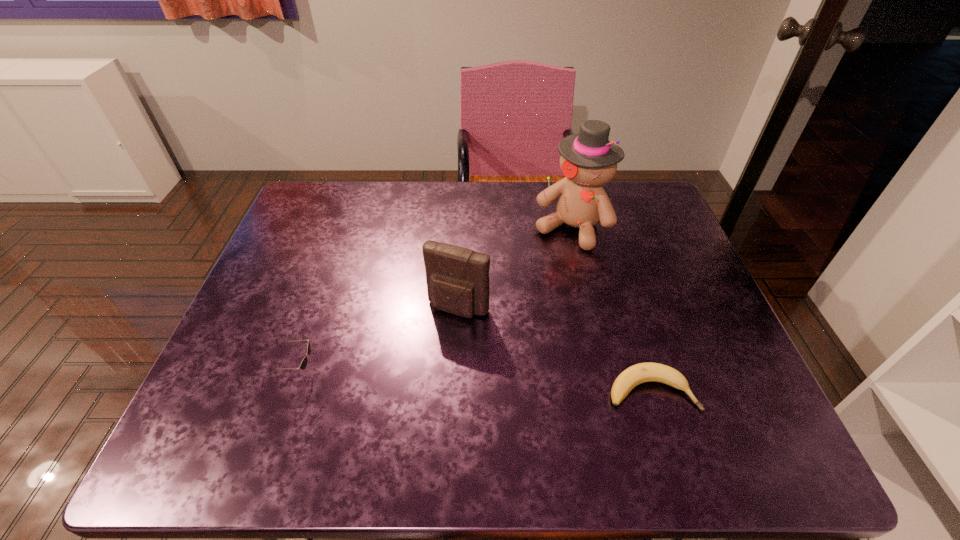
This screenshot has height=540, width=960. In order to click on free space that is in between the banana and the tallest object in this screenshot , I will do click(612, 309).

Identify the location of free space between the banana and the sunglasses. (475, 381).

Where is `free space that is in between the tallest object and the banana`? free space that is in between the tallest object and the banana is located at coordinates (612, 309).

This screenshot has width=960, height=540. Identify the location of the third closest object to the third tallest object. (643, 372).

Image resolution: width=960 pixels, height=540 pixels. I want to click on the second closest object to the third tallest object, so click(588, 160).